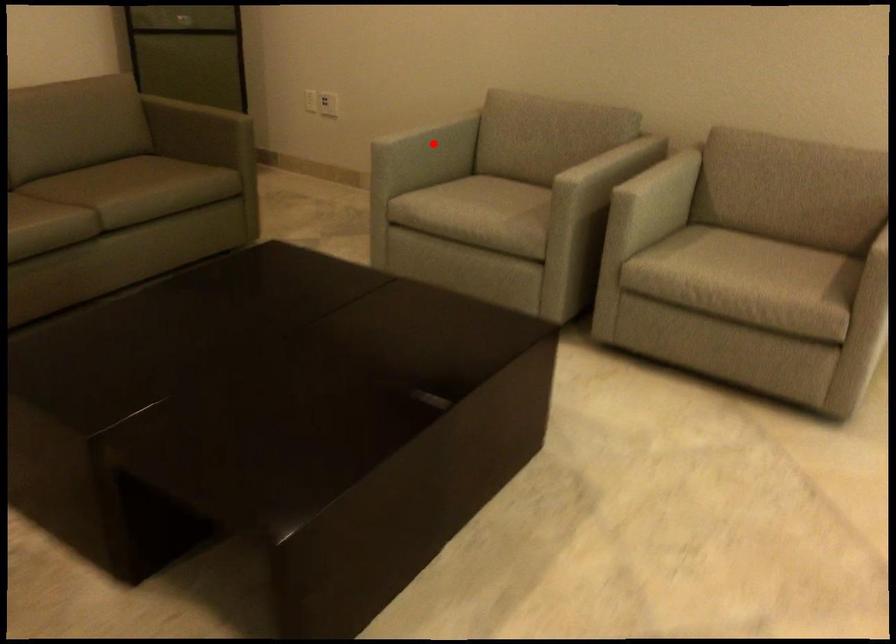
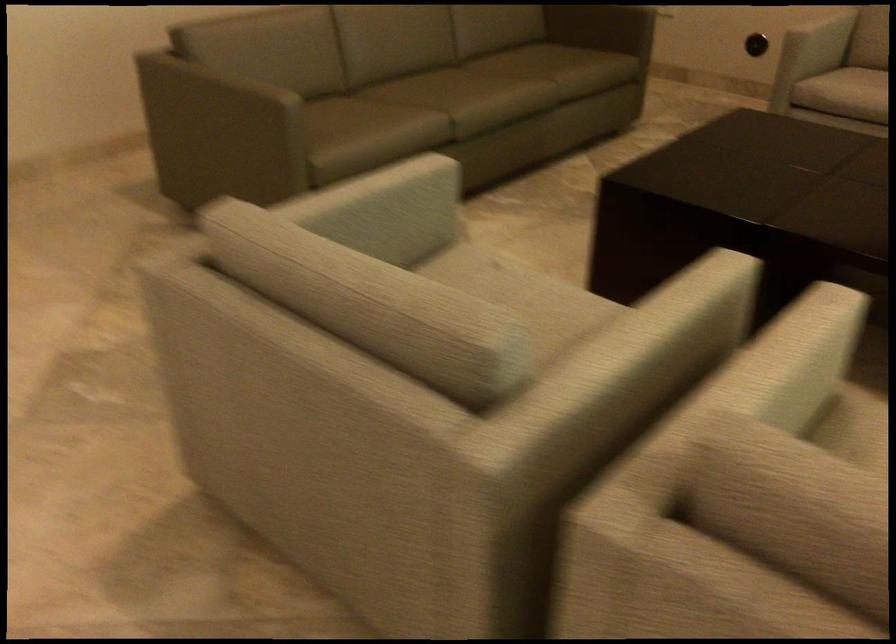
Question: I am providing you with two images of the same scene from different viewpoints. A red point is marked on the first image. Can you still see the location of the red point in image 2?

Choices:
 (A) Yes
 (B) No

Answer: (A)